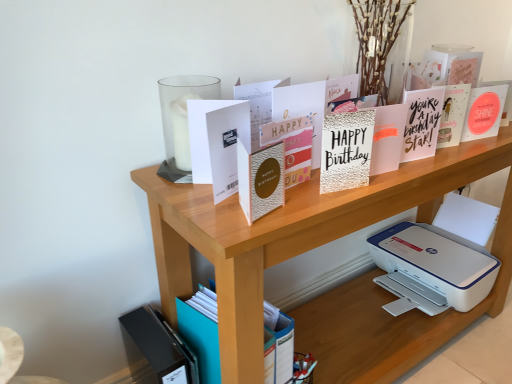
I want to click on vacant area that is in front of silver glitter card at center, the 3th paperback book viewed from the right, so click(x=320, y=207).